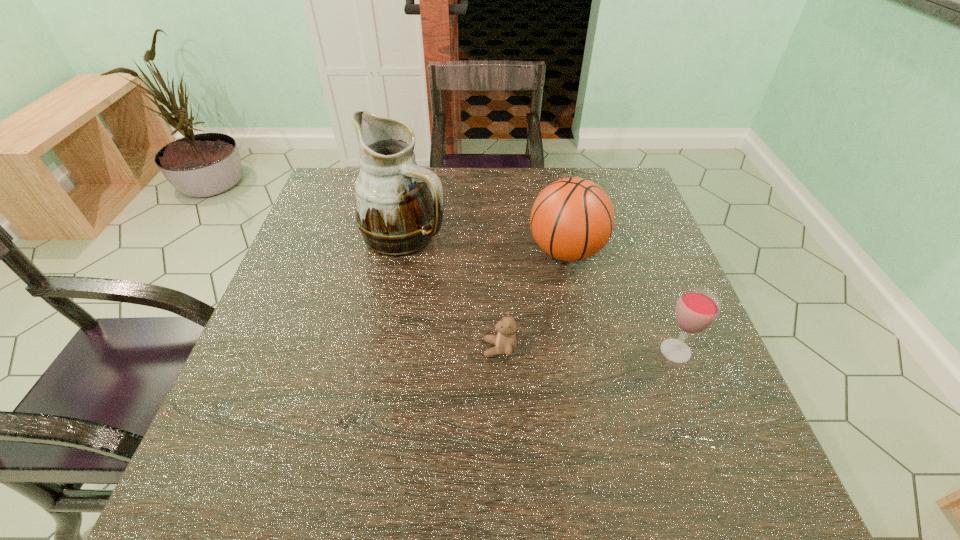
The height and width of the screenshot is (540, 960). I want to click on vacant space that is in between the leftmost object and the basketball, so click(486, 243).

The width and height of the screenshot is (960, 540). I want to click on unoccupied position between the basketball and the pitcher, so click(x=486, y=243).

Identify the location of free space that is in between the third tallest object and the shortest object. The image size is (960, 540). (588, 350).

Find the location of a particular element. The image size is (960, 540). vacant space in between the second tallest object and the third tallest object is located at coordinates (621, 301).

Find the location of `empty space that is in between the wineglass and the pitcher`. empty space that is in between the wineglass and the pitcher is located at coordinates (540, 293).

The image size is (960, 540). I want to click on free space between the second object from right to left and the rightmost object, so click(621, 301).

Locate which object ranks in proximity to the third shortest object. Please provide its 2D coordinates. Your answer should be formatted as a tuple, i.e. [(x, y)], where the tuple contains the x and y coordinates of a point satisfying the conditions above.

[(505, 341)]

At what (x,y) coordinates should I click in order to perform the action: click on the third closest object to the shortest object. Please return your answer as a coordinate pair (x, y). Image resolution: width=960 pixels, height=540 pixels. Looking at the image, I should click on (696, 310).

Locate an element on the screen. The image size is (960, 540). free spot that satisfies the following two spatial constraints: 1. on the front-facing side of the second shortest object; 2. on the left side of the shortest object is located at coordinates (500, 351).

Where is `free spot that satisfies the following two spatial constraints: 1. from the spout of the pitcher; 2. on the back side of the second shortest object`? The image size is (960, 540). free spot that satisfies the following two spatial constraints: 1. from the spout of the pitcher; 2. on the back side of the second shortest object is located at coordinates (383, 351).